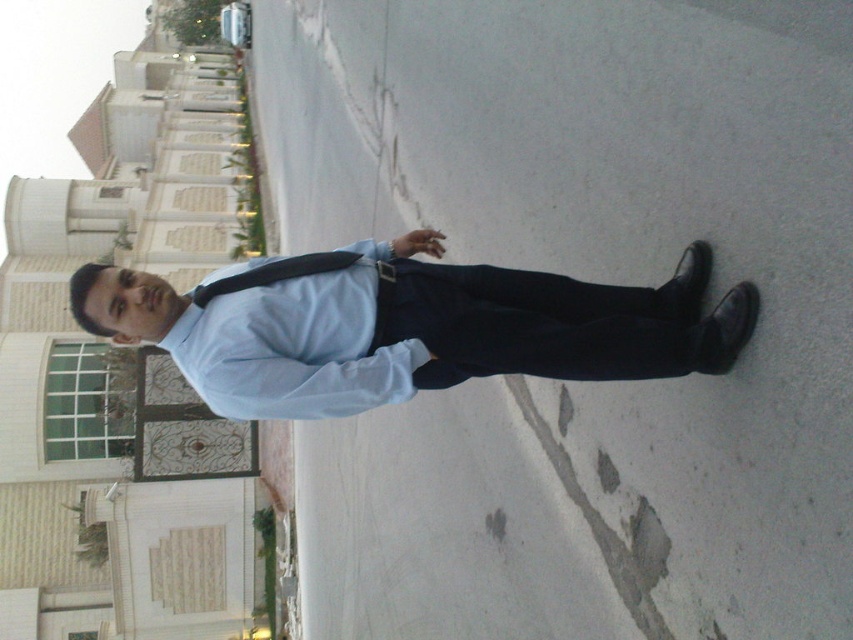
You are a delivery person trying to locate a specific point on the pavement. You are currently standing at point (384, 392). The target point is (582, 376). Which direction should you move to reach the target point?

You should move forward because point (582, 376) is in front of point (384, 392).